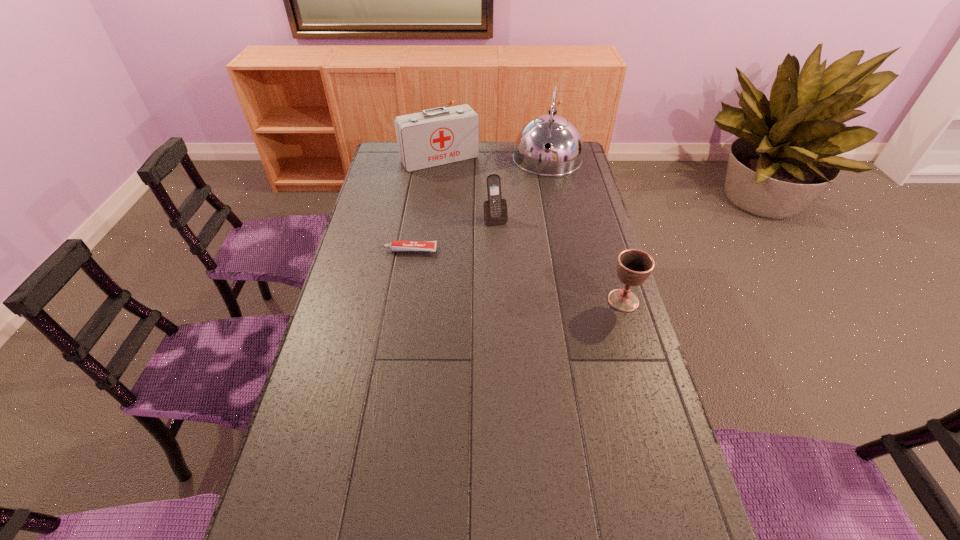
Choose which object is the third nearest neighbor to the kettle. Please provide its 2D coordinates. Your answer should be formatted as a tuple, i.e. [(x, y)], where the tuple contains the x and y coordinates of a point satisfying the conditions above.

[(396, 246)]

Locate an element on the screen. This screenshot has height=540, width=960. object that is the second closest to the kettle is located at coordinates (495, 208).

This screenshot has height=540, width=960. I want to click on vacant point that satisfies the following two spatial constraints: 1. on the front side of the chalice; 2. on the right side of the kettle, so [x=577, y=300].

I want to click on vacant space that satisfies the following two spatial constraints: 1. on the back side of the cellular telephone; 2. on the left side of the kettle, so click(x=493, y=160).